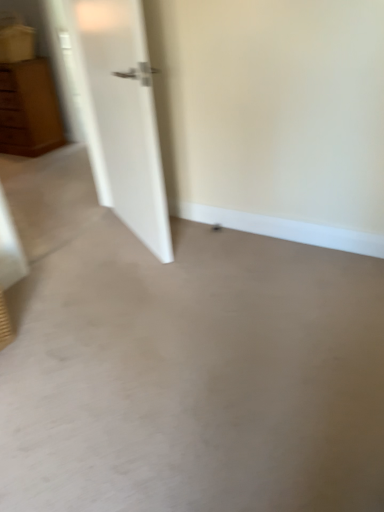
What is the approximate width of matte brown chest of drawers at left?

The width of matte brown chest of drawers at left is 50.36 centimeters.

Describe the element at coordinates (29, 109) in the screenshot. The height and width of the screenshot is (512, 384). I see `matte brown chest of drawers at left` at that location.

Locate an element on the screen. The height and width of the screenshot is (512, 384). matte brown chest of drawers at left is located at coordinates (29, 109).

What do you see at coordinates (194, 376) in the screenshot?
I see `beige matte concrete at center` at bounding box center [194, 376].

Measure the distance between beige matte concrete at center and camera.

The depth of beige matte concrete at center is 1.27 meters.

Image resolution: width=384 pixels, height=512 pixels. I want to click on beige matte concrete at center, so click(x=194, y=376).

Locate an element on the screen. matte brown chest of drawers at left is located at coordinates (29, 109).

Is matte brown chest of drawers at left to the left of beige matte concrete at center from the viewer's perspective?

Yes, matte brown chest of drawers at left is to the left of beige matte concrete at center.

Between matte brown chest of drawers at left and beige matte concrete at center, which one is positioned behind?

matte brown chest of drawers at left.

Considering the positions of point (37, 78) and point (336, 280), is point (37, 78) closer or farther from the camera than point (336, 280)?

Point (37, 78) is positioned farther from the camera compared to point (336, 280).

From the image's perspective, would you say matte brown chest of drawers at left is shown under beige matte concrete at center?

No, from the image's perspective, matte brown chest of drawers at left is not below beige matte concrete at center.

From a real-world perspective, which object rests below the other?

In real-world perspective, beige matte concrete at center is lower.

Between matte brown chest of drawers at left and beige matte concrete at center, which one has smaller width?

matte brown chest of drawers at left.

Is matte brown chest of drawers at left taller than beige matte concrete at center?

Yes.

Can you confirm if matte brown chest of drawers at left is smaller than beige matte concrete at center?

No, matte brown chest of drawers at left is not smaller than beige matte concrete at center.

In the scene shown: Can we say matte brown chest of drawers at left lies outside beige matte concrete at center?

That's correct, matte brown chest of drawers at left is outside of beige matte concrete at center.

Is matte brown chest of drawers at left far away from beige matte concrete at center?

Indeed, matte brown chest of drawers at left is not near beige matte concrete at center.

Is matte brown chest of drawers at left facing towards beige matte concrete at center?

No, matte brown chest of drawers at left is not oriented towards beige matte concrete at center.

Identify the location of concrete that appears below the matte brown chest of drawers at left (from a real-world perspective). (x=194, y=376).

Which is more to the left, beige matte concrete at center or matte brown chest of drawers at left?

matte brown chest of drawers at left is more to the left.

Which object is further away from the camera taking this photo, beige matte concrete at center or matte brown chest of drawers at left?

matte brown chest of drawers at left is further away from the camera.

Which is behind, point (239, 387) or point (25, 146)?

The point (25, 146) is farther from the camera.

From the picture: From the image's perspective, who appears lower, beige matte concrete at center or matte brown chest of drawers at left?

From the image's view, beige matte concrete at center is below.

From a real-world perspective, between beige matte concrete at center and matte brown chest of drawers at left, who is vertically higher?

matte brown chest of drawers at left, from a real-world perspective.

Considering the sizes of objects beige matte concrete at center and matte brown chest of drawers at left in the image provided, who is wider, beige matte concrete at center or matte brown chest of drawers at left?

beige matte concrete at center.

Considering the relative sizes of beige matte concrete at center and matte brown chest of drawers at left in the image provided, is beige matte concrete at center taller than matte brown chest of drawers at left?

Incorrect, the height of beige matte concrete at center is not larger of that of matte brown chest of drawers at left.

Can you confirm if beige matte concrete at center is smaller than matte brown chest of drawers at left?

Yes, beige matte concrete at center is smaller than matte brown chest of drawers at left.

Could matte brown chest of drawers at left be considered to be inside beige matte concrete at center?

No, matte brown chest of drawers at left is not a part of beige matte concrete at center.

Looking at this image, is beige matte concrete at center not near matte brown chest of drawers at left?

That's right, there is a large distance between beige matte concrete at center and matte brown chest of drawers at left.

Could you tell me if beige matte concrete at center is turned towards matte brown chest of drawers at left?

No, beige matte concrete at center is not turned towards matte brown chest of drawers at left.

The width and height of the screenshot is (384, 512). I want to click on chest of drawers behind the beige matte concrete at center, so click(x=29, y=109).

The height and width of the screenshot is (512, 384). I want to click on concrete located in front of the matte brown chest of drawers at left, so click(x=194, y=376).

The image size is (384, 512). I want to click on chest of drawers on the left of beige matte concrete at center, so click(x=29, y=109).